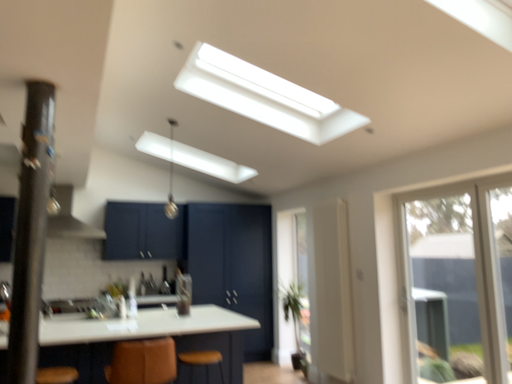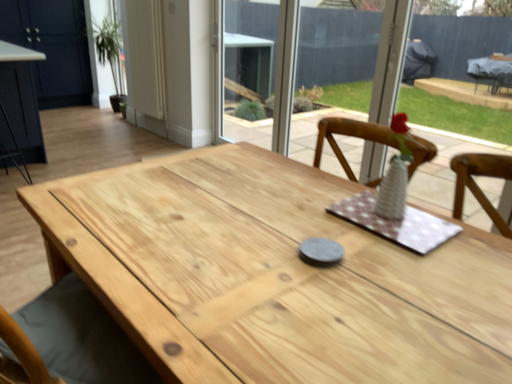
Question: Which way did the camera rotate in the video?

Choices:
 (A) rotated downward
 (B) rotated upward

Answer: (A)